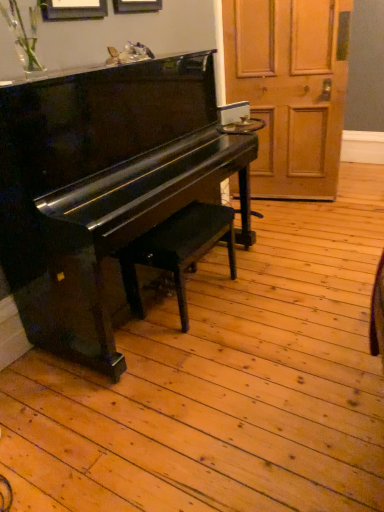
Question: From a real-world perspective, is glossy black piano at left under wooden door at right?

Choices:
 (A) yes
 (B) no

Answer: (A)

Question: Does glossy black piano at left have a greater width compared to wooden door at right?

Choices:
 (A) no
 (B) yes

Answer: (B)

Question: Are glossy black piano at left and wooden door at right making contact?

Choices:
 (A) no
 (B) yes

Answer: (A)

Question: Is glossy black piano at left far from wooden door at right?

Choices:
 (A) yes
 (B) no

Answer: (A)

Question: Is glossy black piano at left closer to the viewer compared to wooden door at right?

Choices:
 (A) yes
 (B) no

Answer: (A)

Question: In terms of width, does wooden door at right look wider or thinner when compared to matte black bench at center?

Choices:
 (A) thin
 (B) wide

Answer: (A)

Question: From the image's perspective, is wooden door at right above or below matte black bench at center?

Choices:
 (A) below
 (B) above

Answer: (B)

Question: Is wooden door at right in front of or behind matte black bench at center in the image?

Choices:
 (A) behind
 (B) front

Answer: (A)

Question: Considering the positions of wooden door at right and matte black bench at center in the image, is wooden door at right taller or shorter than matte black bench at center?

Choices:
 (A) tall
 (B) short

Answer: (A)

Question: Is wooden door at right inside the boundaries of glossy black piano at left, or outside?

Choices:
 (A) outside
 (B) inside

Answer: (A)

Question: Is wooden door at right bigger or smaller than glossy black piano at left?

Choices:
 (A) big
 (B) small

Answer: (B)

Question: Is point (283, 102) positioned closer to the camera than point (74, 134)?

Choices:
 (A) farther
 (B) closer

Answer: (A)

Question: From the image's perspective, is wooden door at right above or below glossy black piano at left?

Choices:
 (A) below
 (B) above

Answer: (B)

Question: Relative to matte black bench at center, is glossy black piano at left in front or behind?

Choices:
 (A) behind
 (B) front

Answer: (B)

Question: From a real-world perspective, is glossy black piano at left positioned above or below matte black bench at center?

Choices:
 (A) above
 (B) below

Answer: (A)